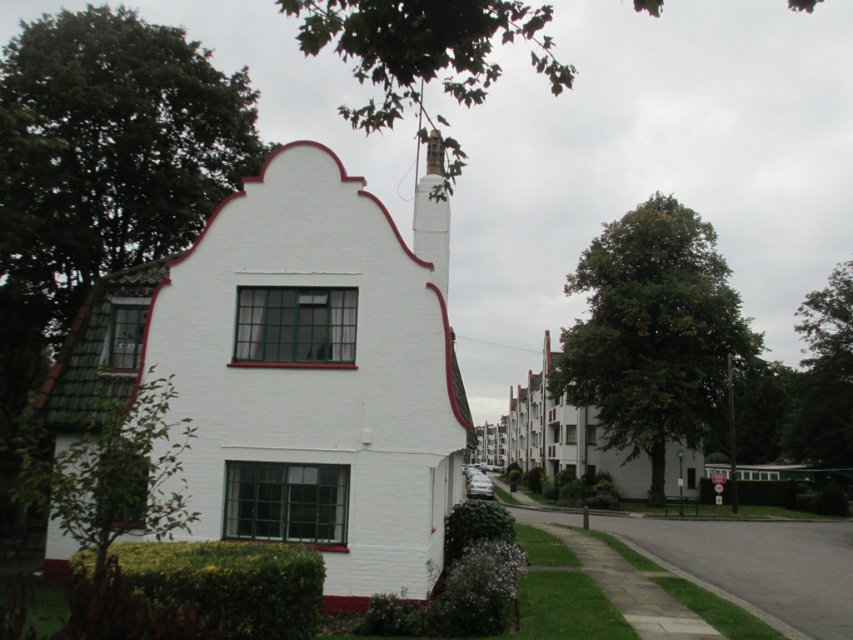
Is white painted brick chimney at center to the right of smooth gray chimney at center from the viewer's perspective?

In fact, white painted brick chimney at center is to the left of smooth gray chimney at center.

Does point (431, 552) come behind point (445, 288)?

No, it is not.

Where is `white painted brick chimney at center`? white painted brick chimney at center is located at coordinates (292, 372).